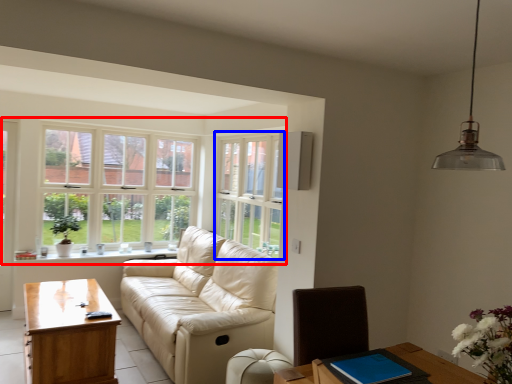
Question: Which of the following is the closest to the observer, window (highlighted by a red box) or window (highlighted by a blue box)?

Choices:
 (A) window
 (B) window

Answer: (B)